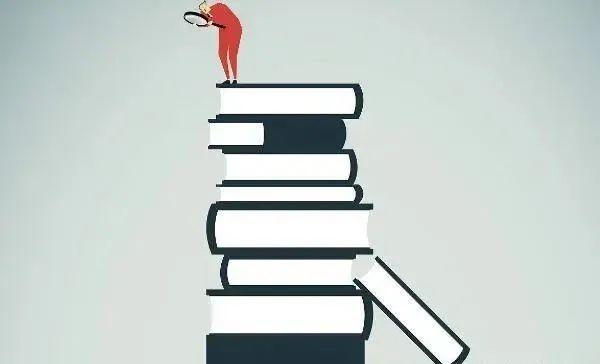
The image size is (600, 364). In order to click on books in this screenshot , I will do `click(263, 349)`, `click(268, 318)`, `click(394, 298)`, `click(296, 269)`, `click(284, 231)`, `click(285, 194)`, `click(285, 168)`, `click(278, 135)`, `click(281, 101)`.